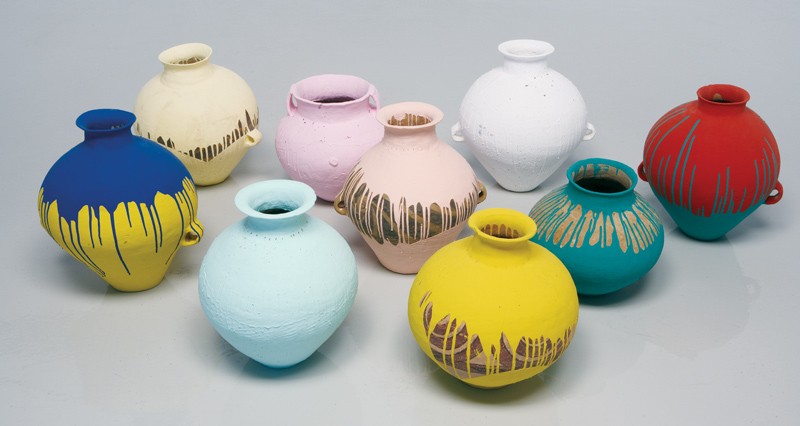
Identify the location of vase. (521, 124).